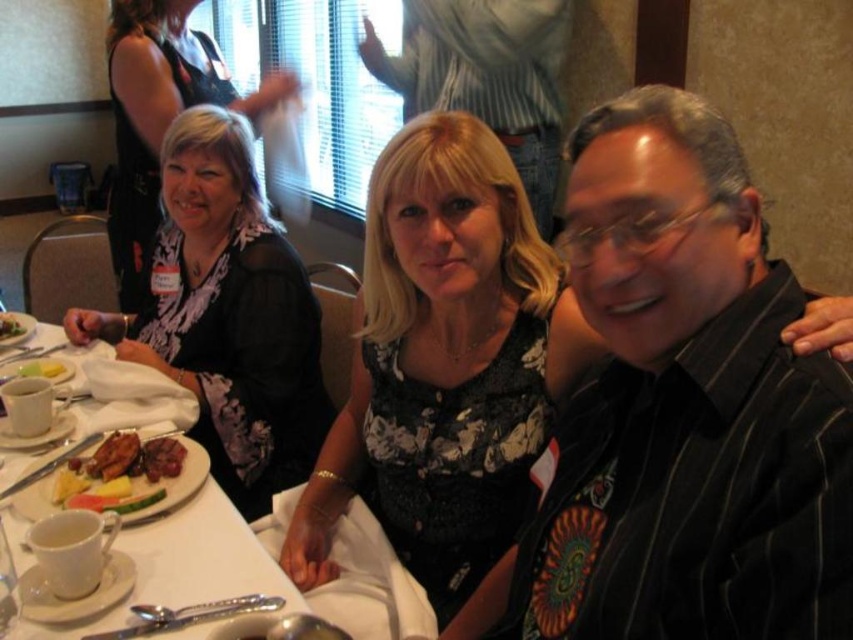
Is black striped shirt at right wider than golden brown meat at center?

Indeed, black striped shirt at right has a greater width compared to golden brown meat at center.

Is black striped shirt at right below golden brown meat at center?

No, black striped shirt at right is not below golden brown meat at center.

Who is more distant from viewer, (608, 138) or (96, 458)?

The point (96, 458) is more distant.

Where is `black striped shirt at right`? This screenshot has width=853, height=640. black striped shirt at right is located at coordinates (680, 412).

Does black sheer dress at left have a lesser height compared to yellow butter at table left?

Incorrect, black sheer dress at left's height does not fall short of yellow butter at table left's.

Which is in front, point (194, 42) or point (61, 372)?

Positioned in front is point (61, 372).

The height and width of the screenshot is (640, 853). I want to click on black sheer dress at left, so click(x=160, y=116).

Which is above, white porcelain plate at left or yellow butter at table left?

yellow butter at table left is higher up.

From the picture: Between white porcelain plate at left and yellow butter at table left, which one is positioned lower?

white porcelain plate at left is lower down.

The image size is (853, 640). Describe the element at coordinates (184, 564) in the screenshot. I see `white porcelain plate at left` at that location.

Locate an element on the screen. Image resolution: width=853 pixels, height=640 pixels. white porcelain plate at left is located at coordinates (x=184, y=564).